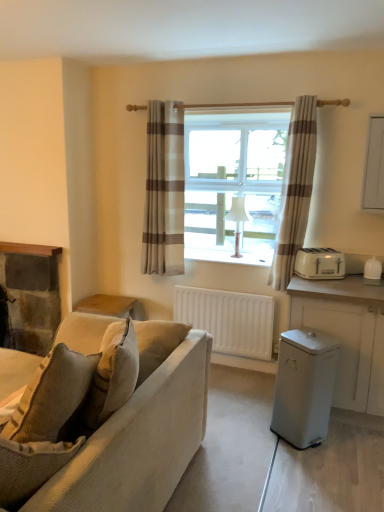
The image size is (384, 512). Identify the location of vacant space situated on the left part of white fabric lampshade at window. (212, 261).